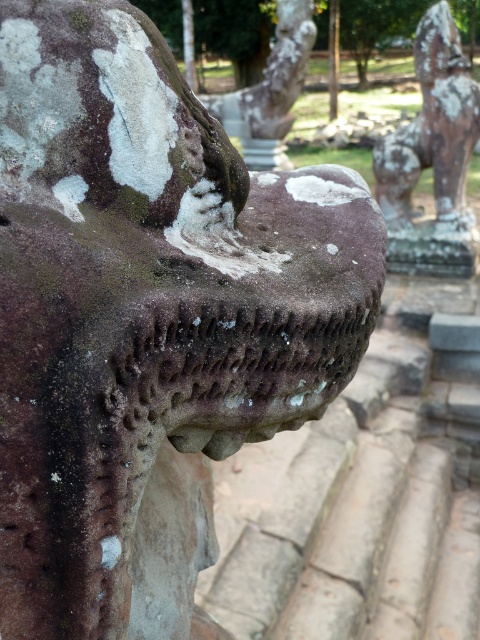
Question: Which object is farther from the camera taking this photo?

Choices:
 (A) rusty stone statue at center
 (B) rusty stone lion at upper right

Answer: (A)

Question: Can you confirm if rusty stone lion at upper right is positioned to the right of rusty stone statue at center?

Choices:
 (A) no
 (B) yes

Answer: (B)

Question: Is rusty stone lion at upper right behind rusty stone statue at center?

Choices:
 (A) no
 (B) yes

Answer: (A)

Question: Can you confirm if rusty stone lion at upper right is wider than rusty stone statue at center?

Choices:
 (A) no
 (B) yes

Answer: (A)